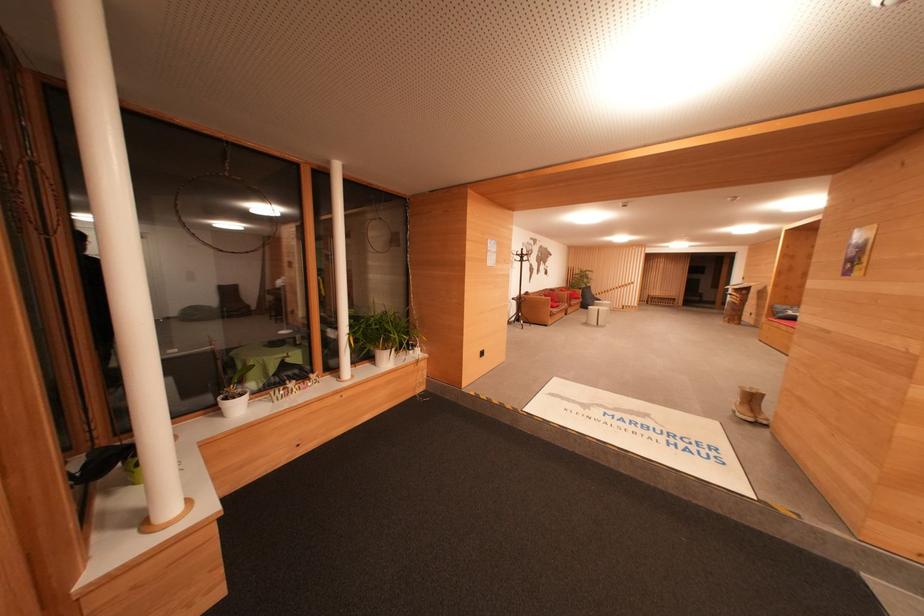
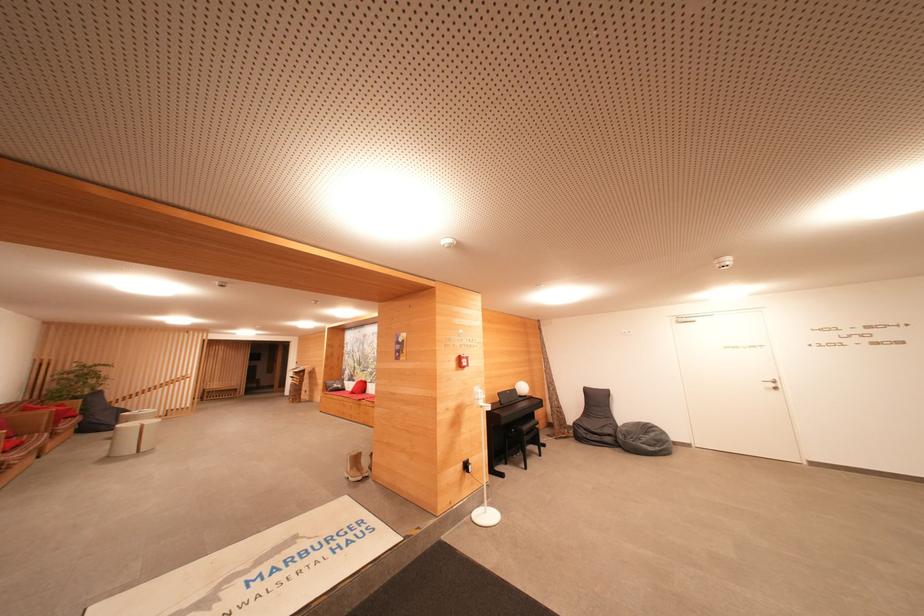
Question: The camera is either moving clockwise (left) or counter-clockwise (right) around the object. The first image is from the beginning of the video and the second image is from the end. Is the camera moving left or right when shooting the video?

Choices:
 (A) Left
 (B) Right

Answer: (A)